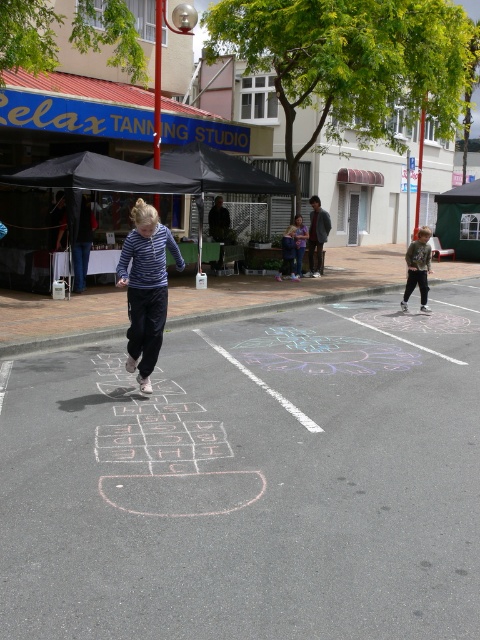
Can you confirm if white chalk hopscotch at center is positioned to the left of camouflage jacket at right?

Correct, you'll find white chalk hopscotch at center to the left of camouflage jacket at right.

Does white chalk hopscotch at center lie in front of camouflage jacket at right?

Yes.

Where is `white chalk hopscotch at center`? Image resolution: width=480 pixels, height=640 pixels. white chalk hopscotch at center is located at coordinates (250, 481).

This screenshot has width=480, height=640. What are the coordinates of `white chalk hopscotch at center` in the screenshot? It's located at (250, 481).

Does white chalk hopscotch at center have a lesser width compared to light blue denim pants at center?

No.

From the picture: Is white chalk hopscotch at center shorter than light blue denim pants at center?

Indeed, white chalk hopscotch at center has a lesser height compared to light blue denim pants at center.

Is point (202, 609) positioned before point (291, 228)?

Yes, it is in front of point (291, 228).

Identify the location of white chalk hopscotch at center. Image resolution: width=480 pixels, height=640 pixels. (250, 481).

Does point (288, 321) come behind point (300, 266)?

No.

Does white chalk hopscotch at center have a lesser height compared to light brown hair at center?

Yes.

Which is in front, point (120, 451) or point (301, 230)?

Point (120, 451)

What are the coordinates of `white chalk hopscotch at center` in the screenshot? It's located at coord(250,481).